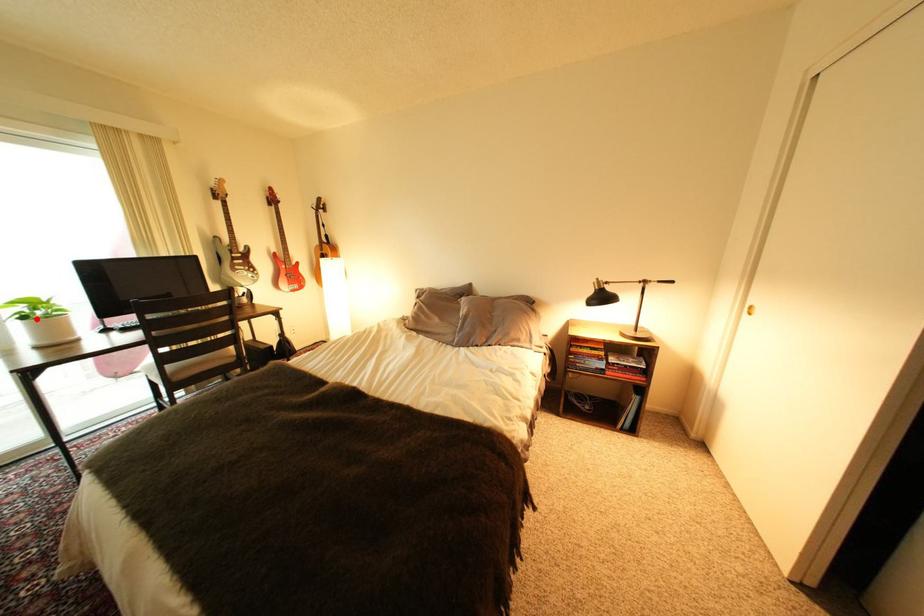
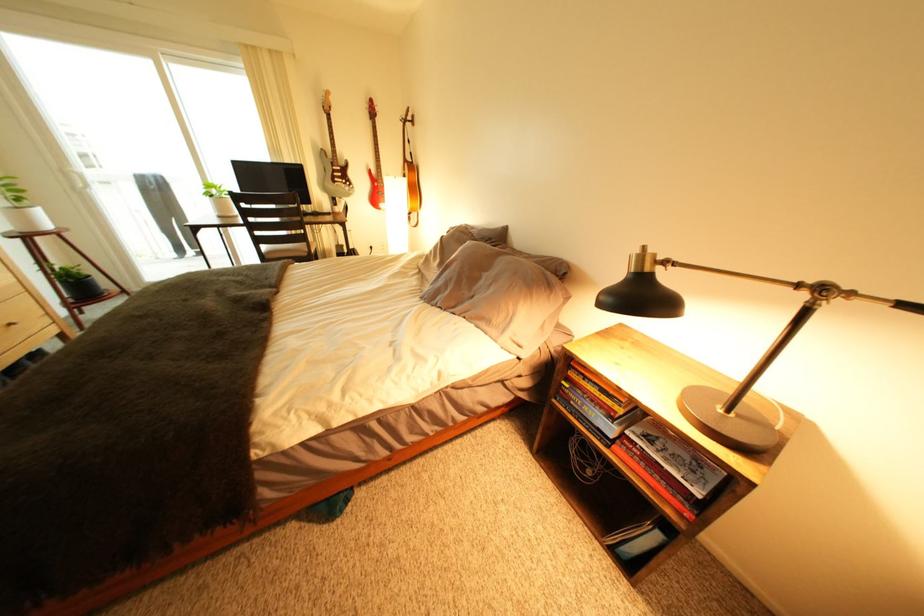
Locate, in the second image, the point that corresponds to the highlighted location in the first image.

(225, 198)